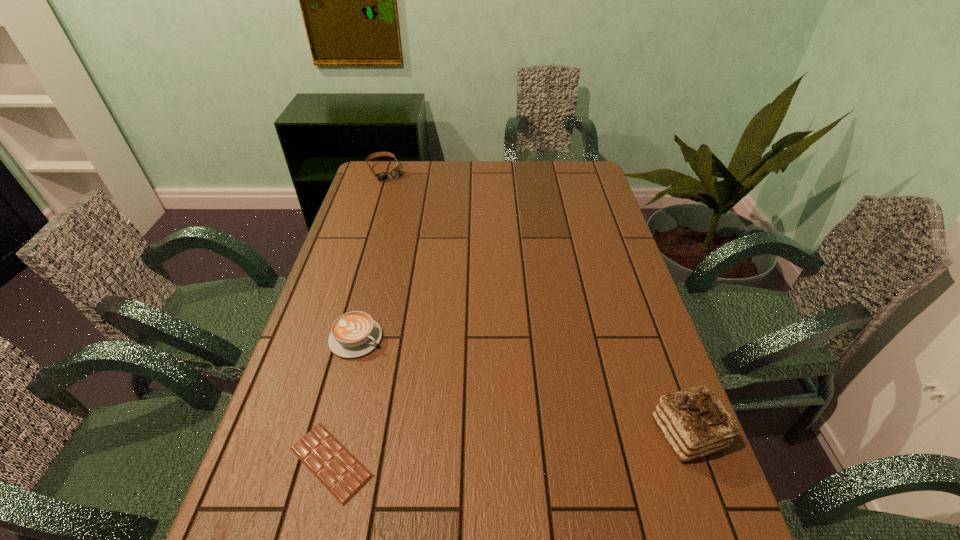
You are a GUI agent. You are given a task and a screenshot of the screen. Output one action in this format:
    pyautogui.click(x=<x>, y=<y>)
    Task: Click on the vacant space on the desktop that is between the shortest object and the rightmost object and is positioned on the side of the third nearest object with the handle
    
    Given the screenshot: What is the action you would take?
    pyautogui.click(x=548, y=444)

What are the coordinates of `free space on the desktop that is between the shortest object and the rightmost object and is positioned on the front-facing side of the goggles` in the screenshot? It's located at (564, 443).